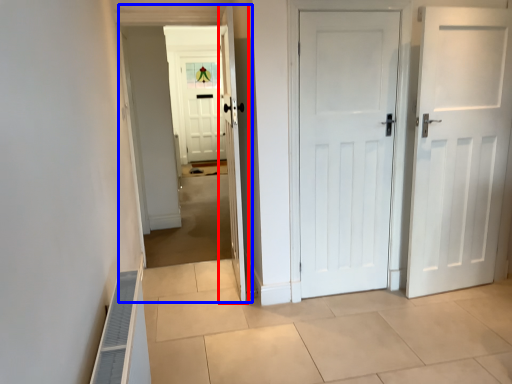
Question: Which of the following is the closest to the observer, door (highlighted by a red box) or corridor (highlighted by a blue box)?

Choices:
 (A) door
 (B) corridor

Answer: (A)